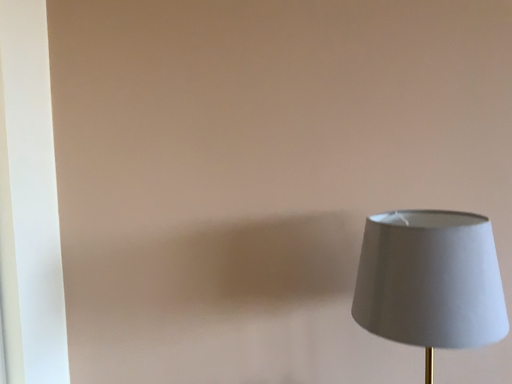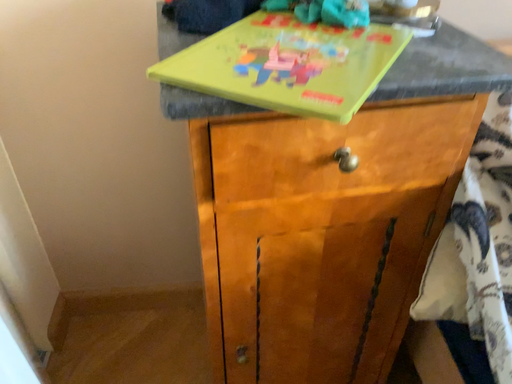
Question: How did the camera likely rotate when shooting the video?

Choices:
 (A) rotated left
 (B) rotated right

Answer: (B)